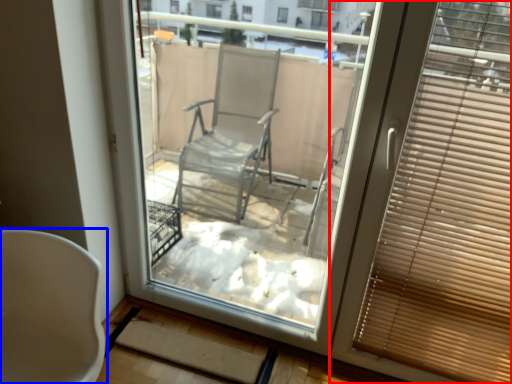
Question: Which object is closer to the camera taking this photo, window blind (highlighted by a red box) or chair (highlighted by a blue box)?

Choices:
 (A) window blind
 (B) chair

Answer: (B)